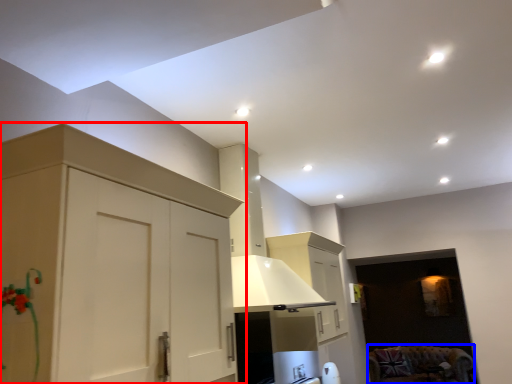
Question: Which point is closer to the camera, cabinetry (highlighted by a red box) or furniture (highlighted by a blue box)?

Choices:
 (A) cabinetry
 (B) furniture

Answer: (A)